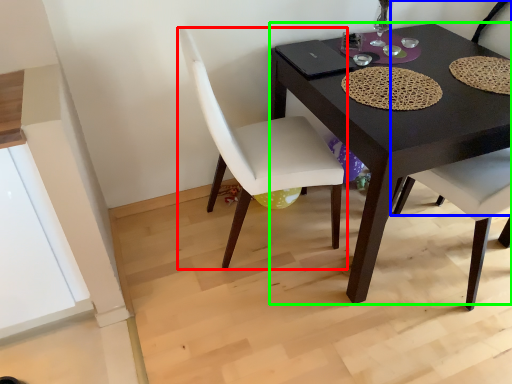
Question: Which object is the closest to the chair (highlighted by a red box)? Choose among these: chair (highlighted by a blue box) or desk (highlighted by a green box).

Choices:
 (A) chair
 (B) desk

Answer: (B)